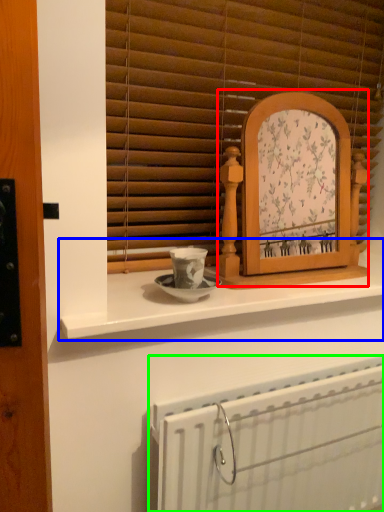
Question: Based on their relative distances, which object is farther from picture frame (highlighted by a red box)? Choose from counter (highlighted by a blue box) and radiator (highlighted by a green box).

Choices:
 (A) counter
 (B) radiator

Answer: (B)